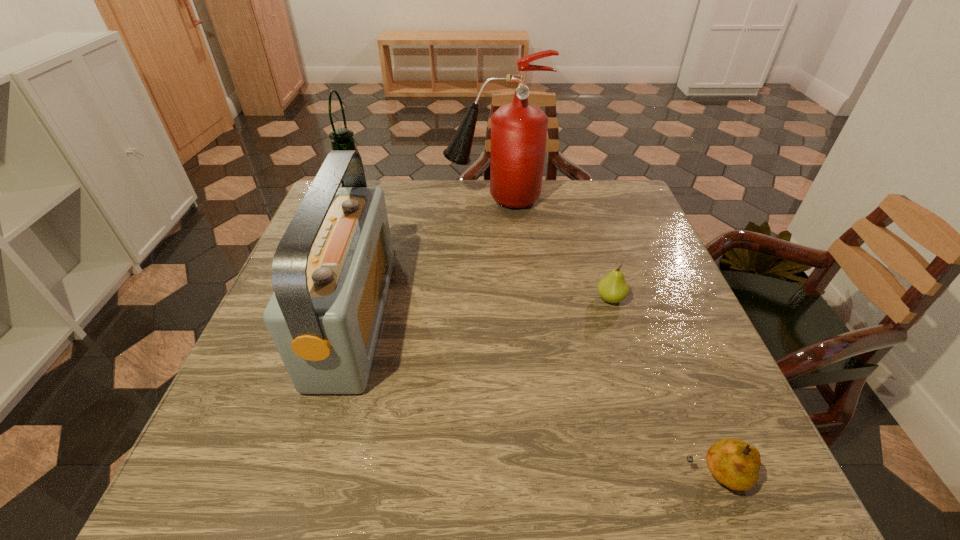
Where is `free space between the nearer pear and the radio receiver`? free space between the nearer pear and the radio receiver is located at coordinates (535, 397).

Find the location of a particular element. This screenshot has height=540, width=960. empty space between the farther pear and the nearest object is located at coordinates (662, 387).

At what (x,y) coordinates should I click in order to perform the action: click on vacant region between the nearest object and the fire extinguisher. Please return your answer as a coordinate pair (x, y). Looking at the image, I should click on (605, 337).

Identify the location of free space between the lantern and the fire extinguisher. The image size is (960, 540). (425, 200).

The image size is (960, 540). I want to click on blank region between the radio receiver and the farther pear, so click(x=482, y=309).

Image resolution: width=960 pixels, height=540 pixels. Identify the location of object that stands as the second closest to the nearer pear. (331, 271).

Identify the location of object that ranks as the second closest to the nearer pear. This screenshot has height=540, width=960. (331, 271).

Where is `free space that satisfies the following two spatial constraints: 1. on the side where the farther pear emits light; 2. on the right side of the lantern`? free space that satisfies the following two spatial constraints: 1. on the side where the farther pear emits light; 2. on the right side of the lantern is located at coordinates (317, 299).

At what (x,y) coordinates should I click in order to perform the action: click on vacant space that satisfies the following two spatial constraints: 1. with the nozzle aimed from the farther pear; 2. on the left side of the fire extinguisher. Please return your answer as a coordinate pair (x, y). Looking at the image, I should click on (499, 299).

Find the location of a particular element. This screenshot has height=540, width=960. vacant point that satisfies the following two spatial constraints: 1. on the side where the lantern emits light; 2. on the left side of the farther pear is located at coordinates (317, 299).